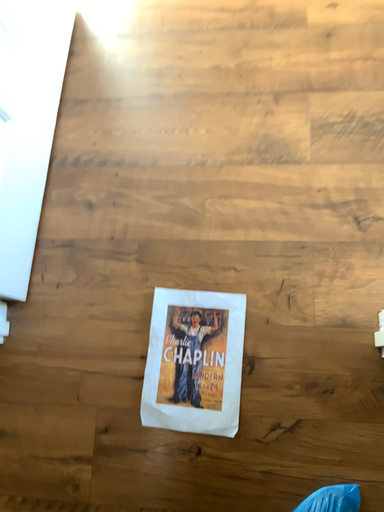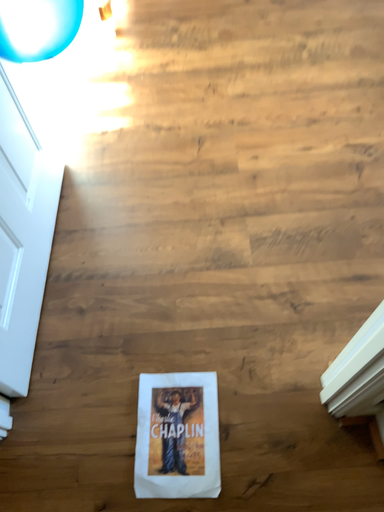
Question: How did the camera likely rotate when shooting the video?

Choices:
 (A) rotated upward
 (B) rotated downward

Answer: (A)